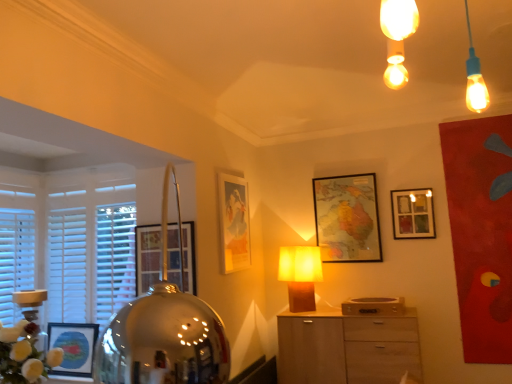
Question: Considering the relative sizes of matte glass picture frame at upper right, the 4th picture frame in the left-to-right sequence, and matte gold picture frame at center, arranged as the 2th picture frame when viewed from the left, in the image provided, is matte glass picture frame at upper right, the 4th picture frame in the left-to-right sequence, wider than matte gold picture frame at center, arranged as the 2th picture frame when viewed from the left,?

Choices:
 (A) yes
 (B) no

Answer: (A)

Question: Can you confirm if matte glass picture frame at upper right, the 4th picture frame in the left-to-right sequence, is thinner than matte gold picture frame at center, the third picture frame positioned from the right?

Choices:
 (A) yes
 (B) no

Answer: (B)

Question: Would you consider matte glass picture frame at upper right, the 4th picture frame in the left-to-right sequence, to be distant from matte gold picture frame at center, the third picture frame positioned from the right?

Choices:
 (A) yes
 (B) no

Answer: (A)

Question: Does matte glass picture frame at upper right, the 4th picture frame in the left-to-right sequence, have a lesser height compared to matte gold picture frame at center, arranged as the 2th picture frame when viewed from the left?

Choices:
 (A) no
 (B) yes

Answer: (B)

Question: Could you tell me if matte glass picture frame at upper right, which is the 1th picture frame from right to left, is facing matte gold picture frame at center, the third picture frame positioned from the right?

Choices:
 (A) yes
 (B) no

Answer: (B)

Question: Is matte glass picture frame at upper right, the 4th picture frame in the left-to-right sequence, smaller than matte gold picture frame at center, the third picture frame positioned from the right?

Choices:
 (A) yes
 (B) no

Answer: (A)

Question: Does light wood cabinet at center have a lesser height compared to matte gold picture frame at center, arranged as the 2th picture frame when viewed from the left?

Choices:
 (A) yes
 (B) no

Answer: (A)

Question: Would you say light wood cabinet at center is a long distance from matte gold picture frame at center, arranged as the 2th picture frame when viewed from the left?

Choices:
 (A) no
 (B) yes

Answer: (A)

Question: Considering the relative sizes of light wood cabinet at center and matte gold picture frame at center, the third picture frame positioned from the right, in the image provided, is light wood cabinet at center thinner than matte gold picture frame at center, the third picture frame positioned from the right,?

Choices:
 (A) yes
 (B) no

Answer: (B)

Question: Does light wood cabinet at center appear on the left side of matte gold picture frame at center, arranged as the 2th picture frame when viewed from the left?

Choices:
 (A) no
 (B) yes

Answer: (A)

Question: From the image's perspective, is light wood cabinet at center over matte gold picture frame at center, the third picture frame positioned from the right?

Choices:
 (A) no
 (B) yes

Answer: (A)

Question: Is matte gold picture frame at center, the third picture frame positioned from the right, completely or partially inside light wood cabinet at center?

Choices:
 (A) yes
 (B) no

Answer: (B)

Question: Can matte glass picture frame at upper right, the 4th picture frame in the left-to-right sequence, be found inside white wooden blinds at left?

Choices:
 (A) yes
 (B) no

Answer: (B)